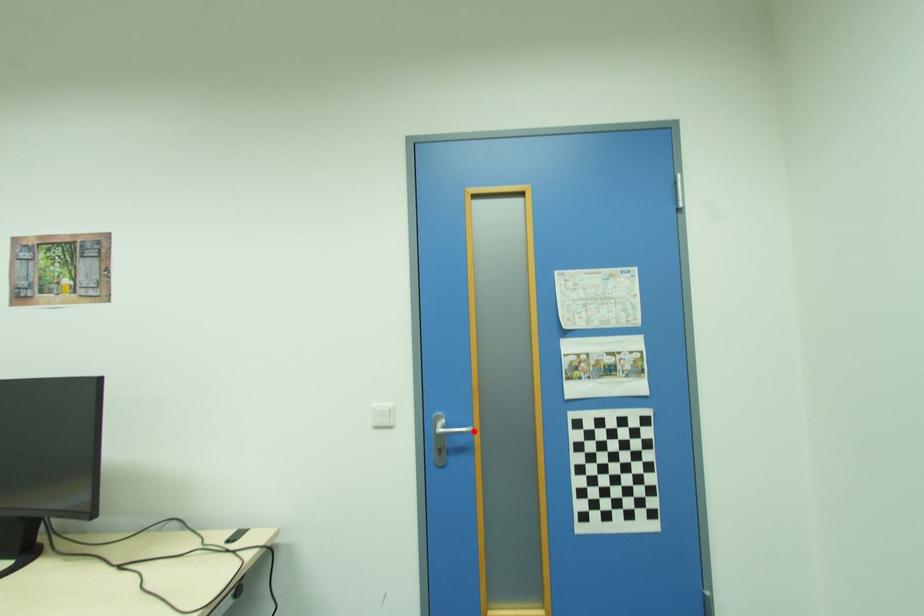
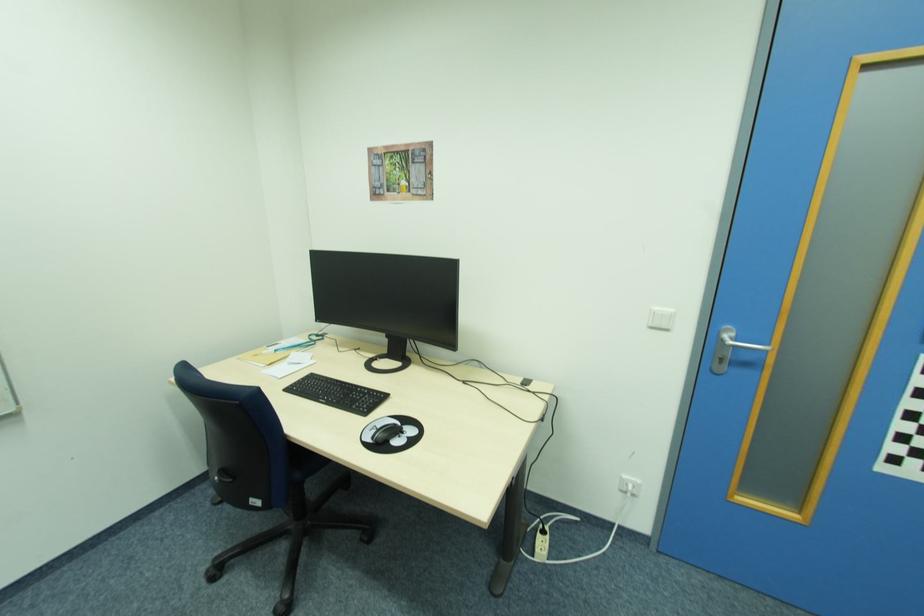
Question: I am providing you with two images of the same scene from different viewpoints. A red point is marked on the first image. Is the red point's position out of view in image 2?

Choices:
 (A) Yes
 (B) No

Answer: (B)